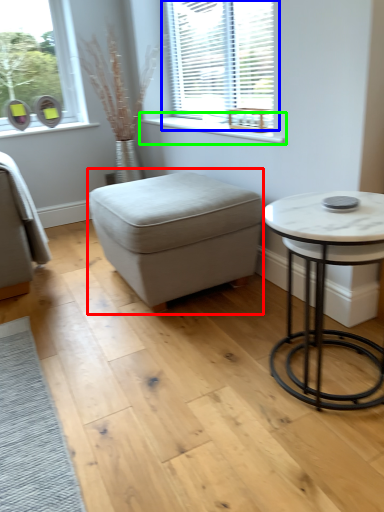
Question: Which object is positioned farthest from music stool (highlighted by a red box)? Select from window (highlighted by a blue box) and window sill (highlighted by a green box).

Choices:
 (A) window
 (B) window sill

Answer: (A)